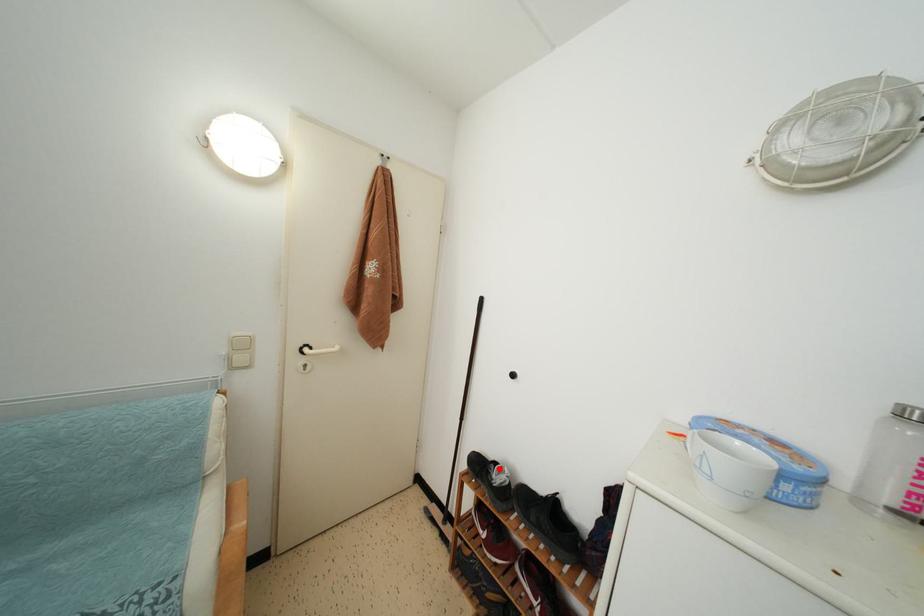
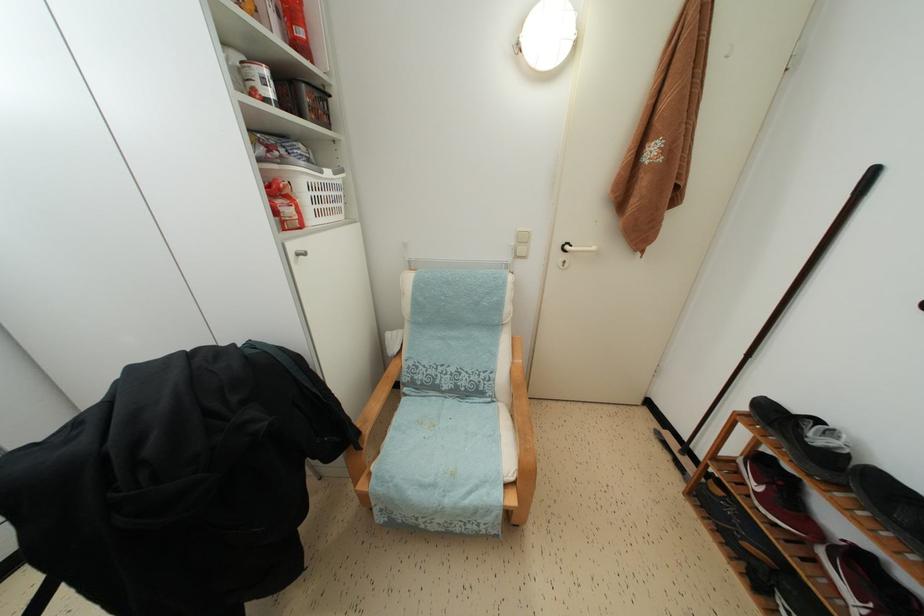
In the second image, find the point that corresponds to the highlighted location in the first image.

(821, 427)